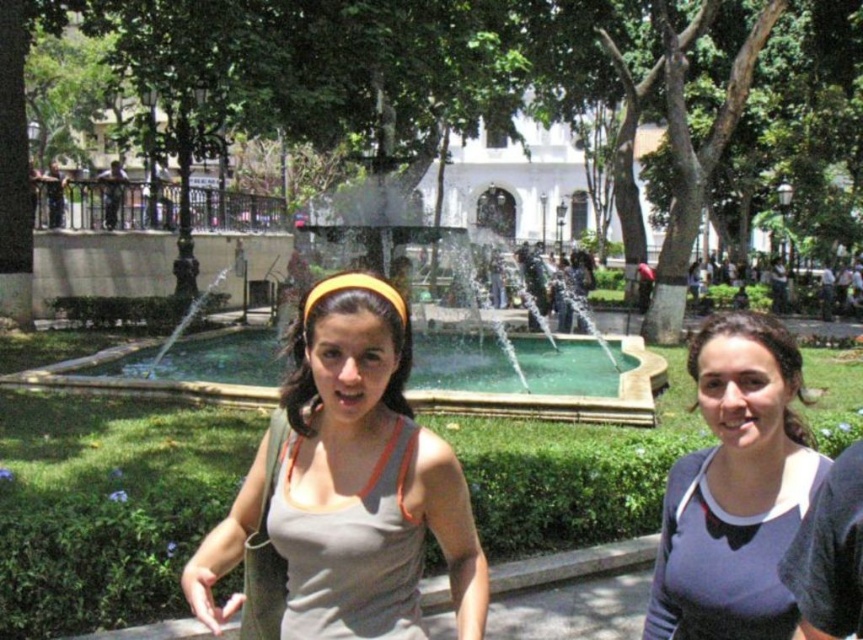
You are standing at the point marked as point (697, 561) in the image. You want to walk to the fountain located behind the two people. Is the fountain closer to you or farther away than 15 meters?

The distance between you and point (697, 561) is 13.64 meters. Since the fountain is behind the two people, it is farther away from your current position. Therefore, the fountain is more than 15 meters away from you.

In the scene shown: You are a photographer standing at the fountain. You want to take a photo of both the matte gray tank top at center and the gray matte tank top at center. Can you fit both in your camera frame if your camera has a maximum horizontal field of view of 5 meters?

The distance between the matte gray tank top at center and the gray matte tank top at center is 4.80 meters, which is less than the camera frame width of 5 meters. Therefore, both can be captured in a single frame.

You are a fashion designer observing two people in the park. You notice the matte gray tank top at center and the gray matte tank top at center. Which one has a thinner fabric?

The matte gray tank top at center is thinner than the gray matte tank top at center, so the matte gray tank top at center has a thinner fabric.